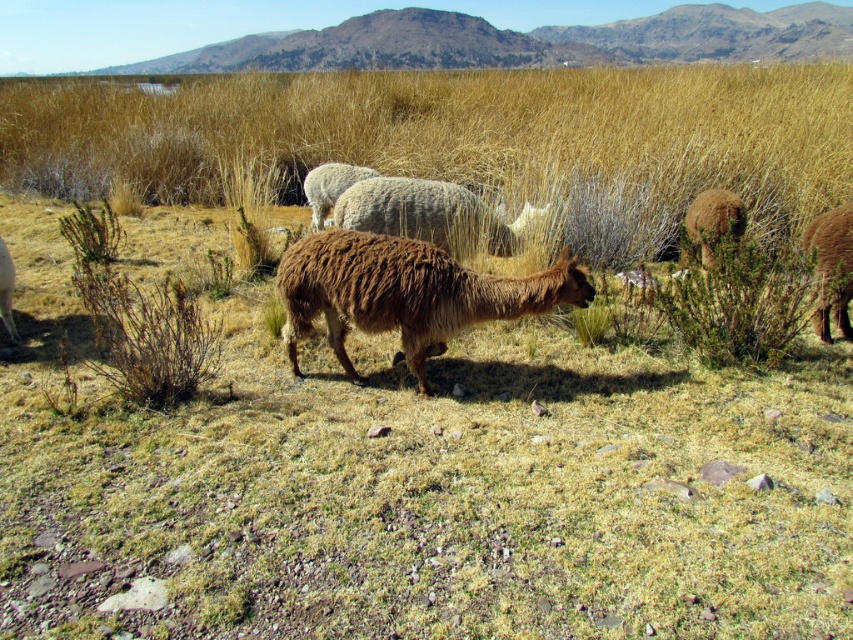
You are standing in the field and want to approach both the white woolly sheep at center and the brown woolen sheep at lower left. Which sheep will you reach first as you walk forward?

You will reach the white woolly sheep at center first because it is closer to you than the brown woolen sheep at lower left, which is further away.